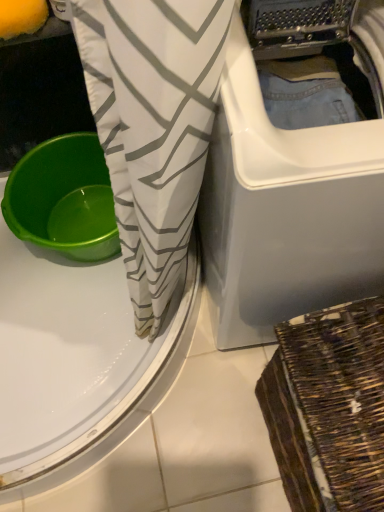
Question: Is white plastic washing machine at center bigger or smaller than white fabric with gray zigzag pattern at center?

Choices:
 (A) big
 (B) small

Answer: (A)

Question: Considering the positions of white plastic washing machine at center and white fabric with gray zigzag pattern at center in the image, is white plastic washing machine at center wider or thinner than white fabric with gray zigzag pattern at center?

Choices:
 (A) thin
 (B) wide

Answer: (B)

Question: Which object is positioned closest to the white fabric with gray zigzag pattern at center?

Choices:
 (A) green plastic basin at left
 (B) woven brown basket at lower right
 (C) white plastic washing machine at center

Answer: (C)

Question: Which object is positioned farthest from the green plastic basin at left?

Choices:
 (A) woven brown basket at lower right
 (B) white plastic washing machine at center
 (C) white fabric with gray zigzag pattern at center

Answer: (A)